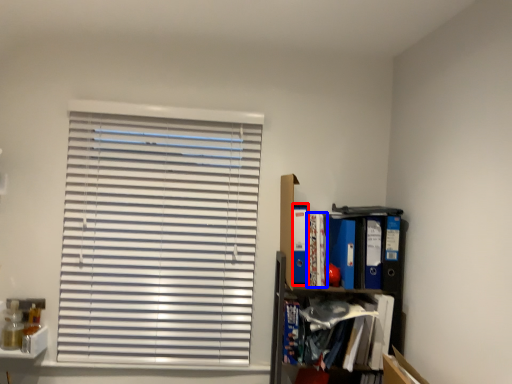
Question: Among these objects, which one is nearest to the camera, paperback book (highlighted by a red box) or book (highlighted by a blue box)?

Choices:
 (A) paperback book
 (B) book

Answer: (B)